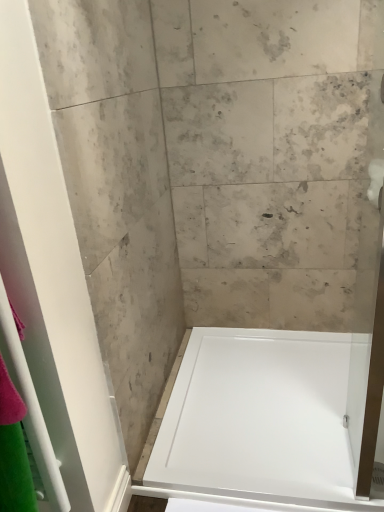
Question: Considering the relative positions of white glossy shower door at left and white matte toilet paper at upper right in the image provided, is white glossy shower door at left to the left or to the right of white matte toilet paper at upper right?

Choices:
 (A) left
 (B) right

Answer: (A)

Question: Is white glossy shower door at left in front of or behind white matte toilet paper at upper right in the image?

Choices:
 (A) front
 (B) behind

Answer: (A)

Question: Which object is positioned farthest from the white matte toilet paper at upper right?

Choices:
 (A) white glossy shower door at left
 (B) white glossy bathtub at center

Answer: (A)

Question: Based on their relative distances, which object is farther from the white matte toilet paper at upper right?

Choices:
 (A) white glossy shower door at left
 (B) white glossy bathtub at center

Answer: (A)